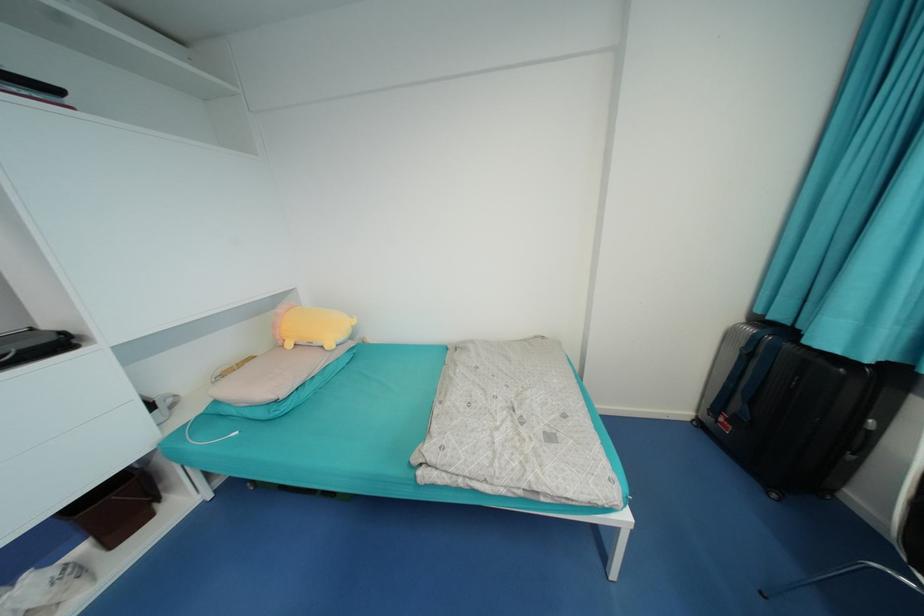
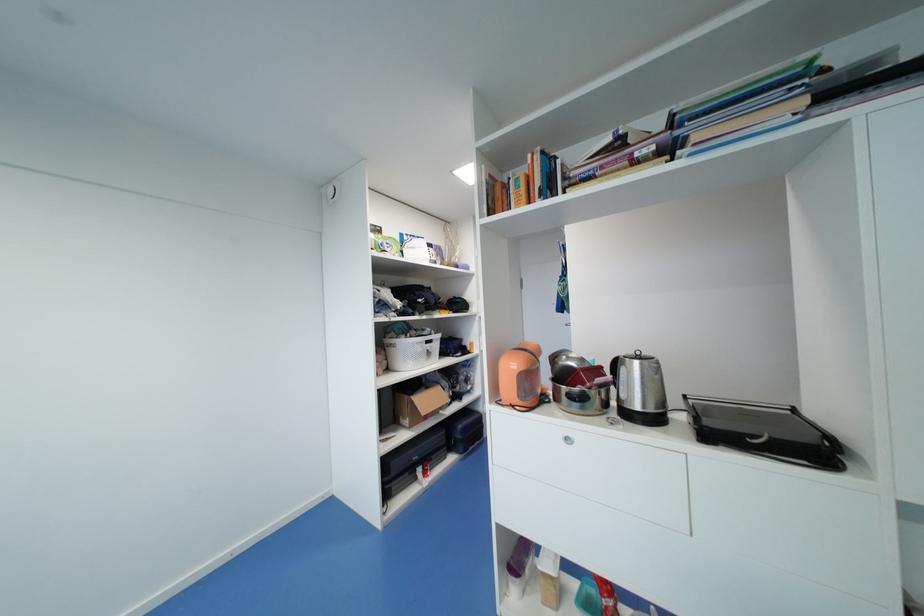
Question: The camera is either moving clockwise (left) or counter-clockwise (right) around the object. The first image is from the beginning of the video and the second image is from the end. Is the camera moving left or right when shooting the video?

Choices:
 (A) Left
 (B) Right

Answer: (B)